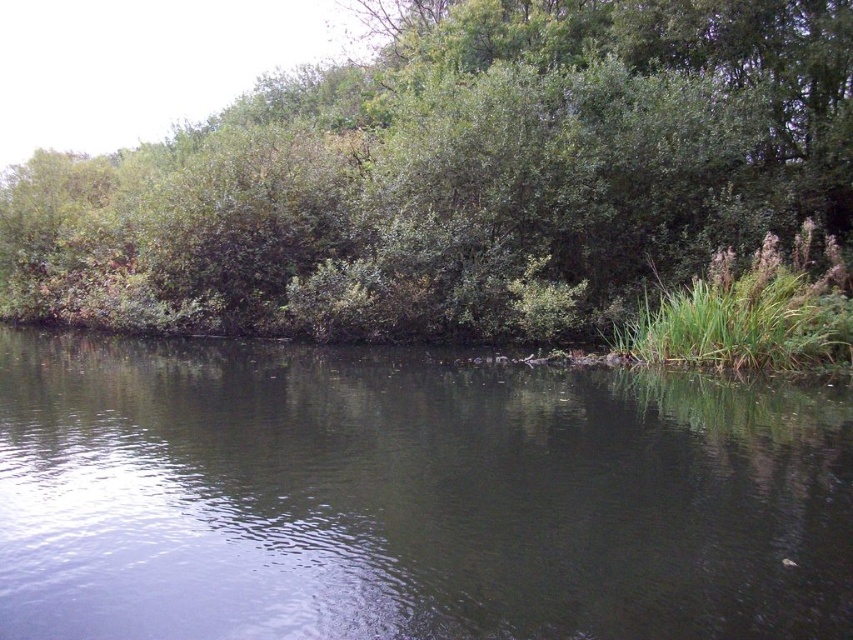
Question: Which of the following is the farthest from the observer?

Choices:
 (A) (25, 536)
 (B) (815, 106)

Answer: (B)

Question: Is greenish-gray water at center positioned behind green leafy bush at upper center?

Choices:
 (A) no
 (B) yes

Answer: (A)

Question: Can you confirm if greenish-gray water at center is thinner than green leafy bush at upper center?

Choices:
 (A) no
 (B) yes

Answer: (B)

Question: Does greenish-gray water at center appear under green leafy bush at upper center?

Choices:
 (A) yes
 (B) no

Answer: (A)

Question: Which point is closer to the camera taking this photo?

Choices:
 (A) (36, 262)
 (B) (795, 573)

Answer: (B)